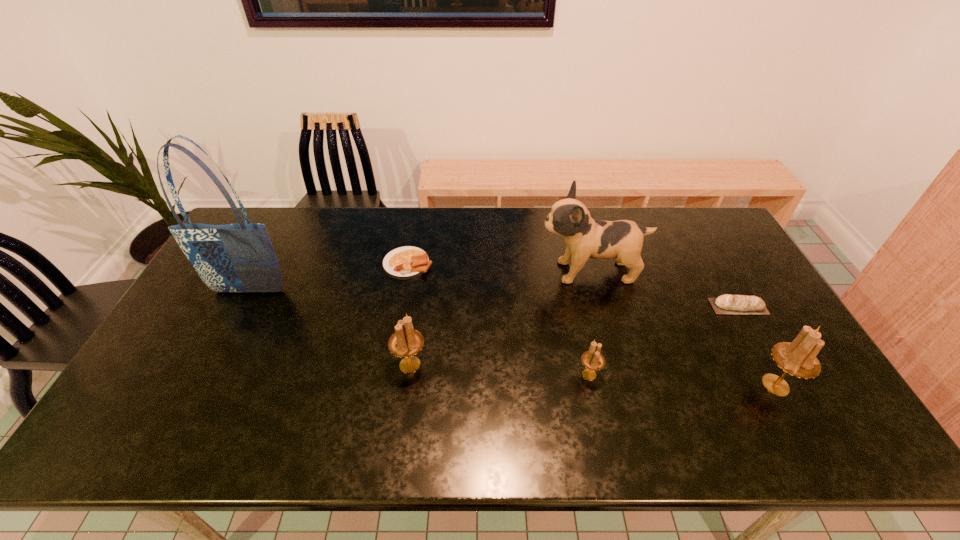
Find the location of a particular element. This screenshot has height=540, width=960. the leftmost object is located at coordinates (240, 257).

This screenshot has height=540, width=960. I want to click on blank space located on the back of the leftmost candle holder, so point(423,266).

Where is `free spot located on the left of the shortest candle holder`? free spot located on the left of the shortest candle holder is located at coordinates (485, 375).

This screenshot has height=540, width=960. I want to click on vacant space located 0.060m on the left of the rightmost candle holder, so click(731, 385).

Find the location of a particular element. free region located on the left of the omelet is located at coordinates (264, 264).

In order to click on vacant area situated 0.280m on the back of the pita bread in this screenshot , I will do `click(701, 240)`.

This screenshot has width=960, height=540. What are the coordinates of `blank space located at the face of the sixth shortest object` in the screenshot? It's located at (473, 272).

The image size is (960, 540). I want to click on free space located 0.240m at the face of the sixth shortest object, so click(465, 272).

Where is `vacant region located 0.300m at the face of the sixth shortest object`? vacant region located 0.300m at the face of the sixth shortest object is located at coordinates (445, 272).

You are a GUI agent. You are given a task and a screenshot of the screen. Output one action in this format:
    pyautogui.click(x=<x>, y=<y>)
    Task: Click on the free region located 0.170m on the front-facing side of the leftmost object
    The height and width of the screenshot is (540, 960).
    Given the screenshot: What is the action you would take?
    pyautogui.click(x=223, y=342)